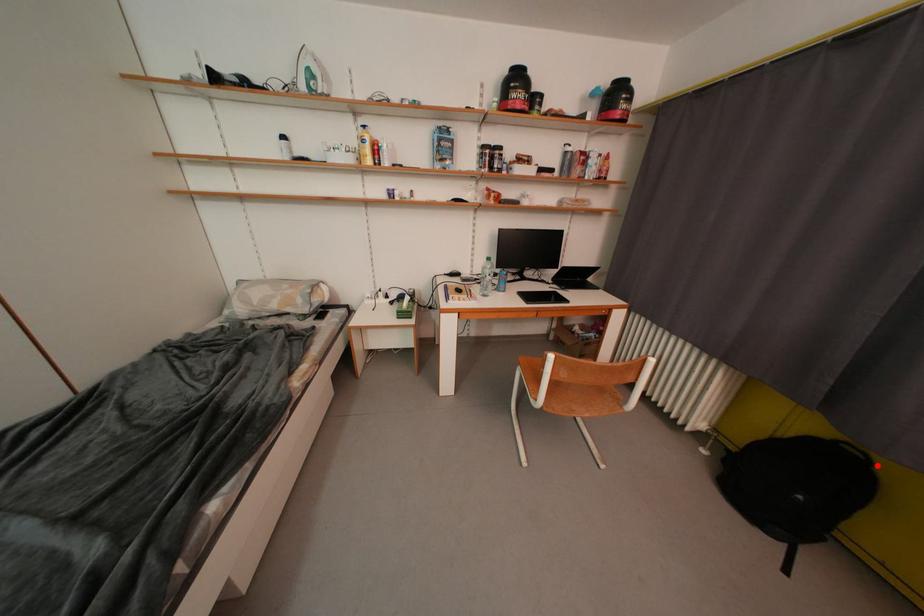
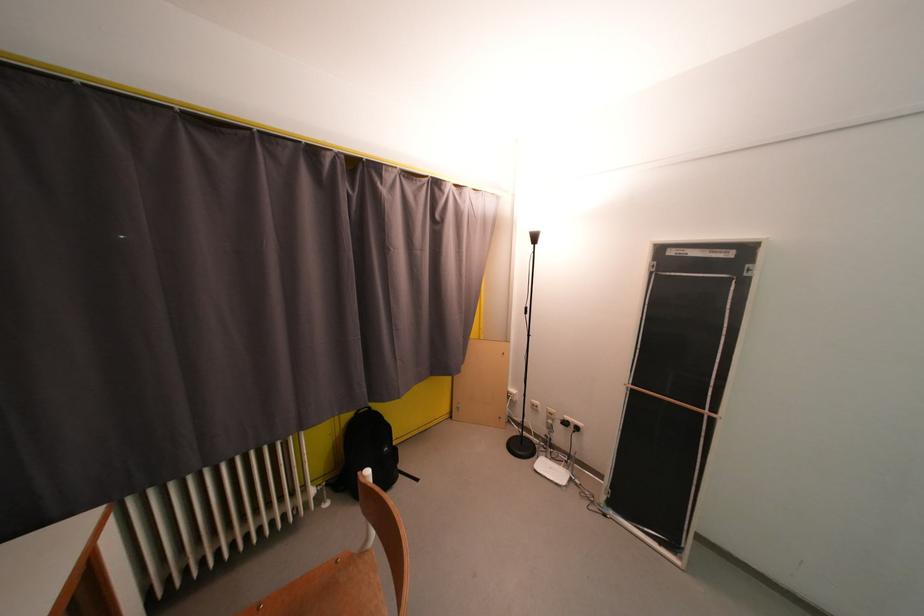
Question: I am providing you with two images of the same scene from different viewpoints. A red point is shown in image1. For the corresponding object point in image2, is it positioned nearer or farther from the camera?

Choices:
 (A) Nearer
 (B) Farther

Answer: (B)